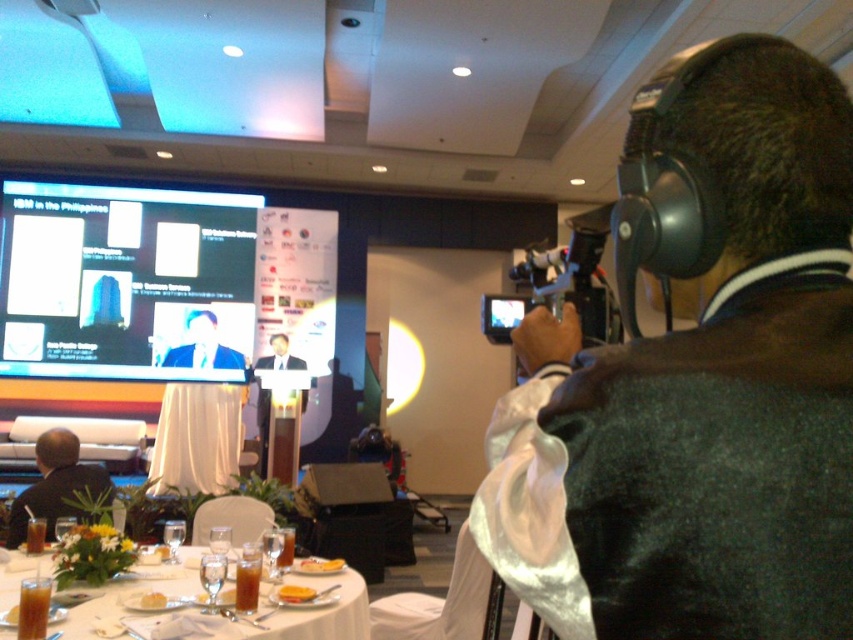
Does dark suit jacket at lower left appear under yellow cake at center?

No.

Who is higher up, dark suit jacket at lower left or yellow cake at center?

dark suit jacket at lower left is higher up.

Between point (38, 499) and point (312, 568), which one is positioned in front?

Point (312, 568) is more forward.

The image size is (853, 640). Find the location of `dark suit jacket at lower left`. dark suit jacket at lower left is located at coordinates (54, 484).

Who is more distant from viewer, (199, 240) or (315, 573)?

Point (199, 240)

Can you confirm if matte black screen at upper left is wider than yellow cake at center?

Indeed, matte black screen at upper left has a greater width compared to yellow cake at center.

Who is more forward, (x=322, y=346) or (x=341, y=566)?

Positioned in front is point (x=341, y=566).

Image resolution: width=853 pixels, height=640 pixels. Find the location of `matte black screen at upper left`. matte black screen at upper left is located at coordinates (158, 282).

Is matte black suit at center above yellow bread at center?

Correct, matte black suit at center is located above yellow bread at center.

Does matte black suit at center have a lesser width compared to yellow bread at center?

Incorrect, matte black suit at center's width is not less than yellow bread at center's.

Which is behind, point (219, 355) or point (311, 598)?

The point (219, 355) is behind.

Find the location of `matte black suit at center`. matte black suit at center is located at coordinates click(x=202, y=346).